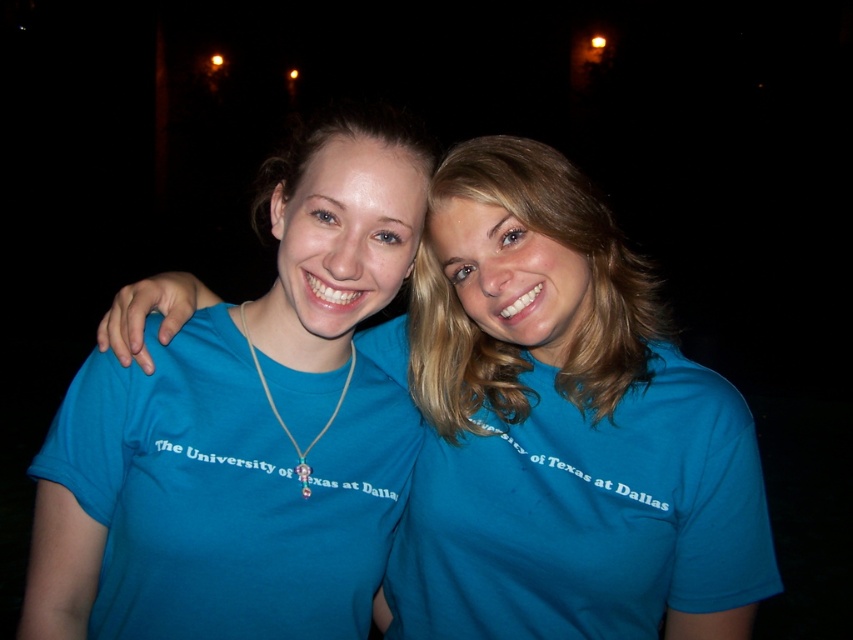
Based on the photo, you are a photographer trying to adjust the lighting for a group photo. You notice two blue shirts at the center of the image. Which of the two shirts, the blue fabric shirt at center or the blue cotton shirt at center, should you focus on first to ensure proper exposure, considering their sizes?

The blue fabric shirt at center is taller than the blue cotton shirt at center, so you should focus on the blue fabric shirt at center first to ensure proper exposure since it has a larger surface area.

You are a photographer trying to focus on the blue fabric shirt at center. Given that the camera focuses on the point at coordinates point (561, 428), will the blue fabric shirt at center be in focus?

The blue fabric shirt at center is represented by point (561, 428), so yes, the camera focusing on that point will have the blue fabric shirt at center in focus.